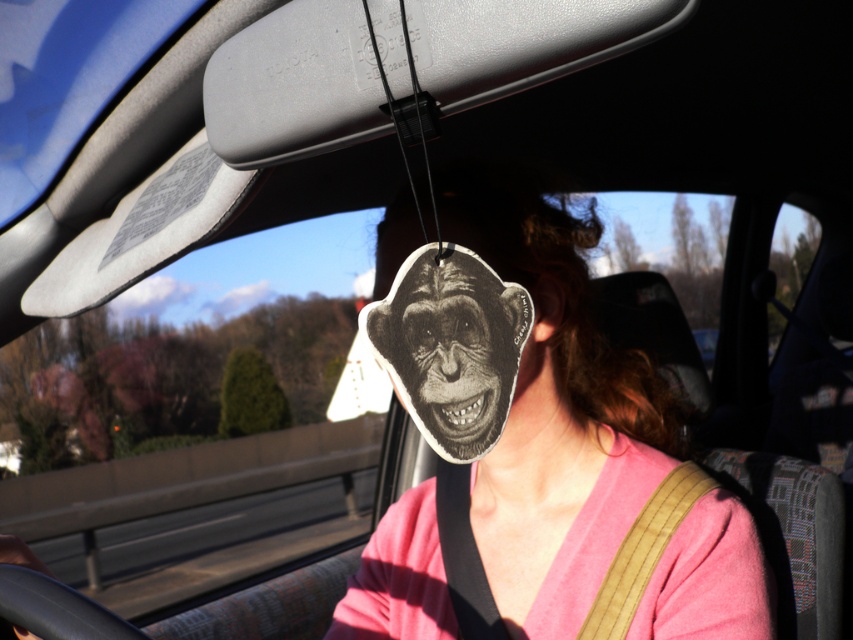
You are a photographer trying to capture a closeup shot of the matte paper monkey face at center. You have a camera that can focus on objects within 3 feet. Can you take the photo without moving closer?

The matte paper monkey face at center and camera are 3.45 feet apart from each other, which is beyond the camera focus range of 3 feet. Therefore, you cannot take the photo without moving closer.

You are sitting in the driver seat of the car. You want to place a new air freshener on the rearview mirror, but there is already an object at point (556, 420). What is the name of the object currently occupying that position?

The object at point (556, 420) is the matte paper monkey face at center.

You are a passenger in a car and notice two monkey face air fresheners hanging from the rearview mirror. The first is a matte paper monkey face at center and the second is a black paper monkey face at center. Which one is wider?

The matte paper monkey face at center is wider than the black paper monkey face at center.